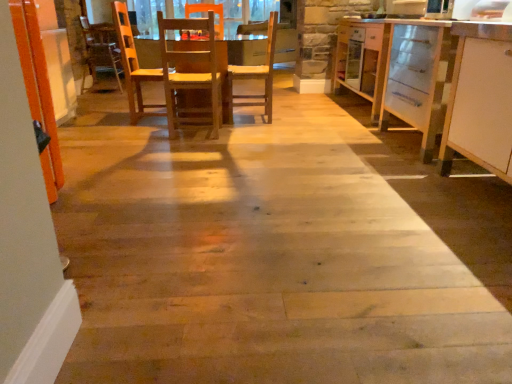
Question: In the image, is wooden chair at center, the second chair from the right, on the left side or the right side of wooden table at center?

Choices:
 (A) left
 (B) right

Answer: (A)

Question: Relative to wooden table at center, is wooden chair at center, the second chair from the right, in front or behind?

Choices:
 (A) behind
 (B) front

Answer: (B)

Question: Considering the real-world distances, which object is closest to the white matte cabinet at right?

Choices:
 (A) wooden chair at center, the 2th chair in the left-to-right sequence
 (B) wooden table at center
 (C) wooden chair at center, marked as the 1th chair in a left-to-right arrangement

Answer: (A)

Question: Which object is the farthest from the wooden chair at center, which is counted as the 1th chair, starting from the right?

Choices:
 (A) wooden chair at center, marked as the 1th chair in a left-to-right arrangement
 (B) white matte cabinet at right
 (C) wooden table at center

Answer: (B)